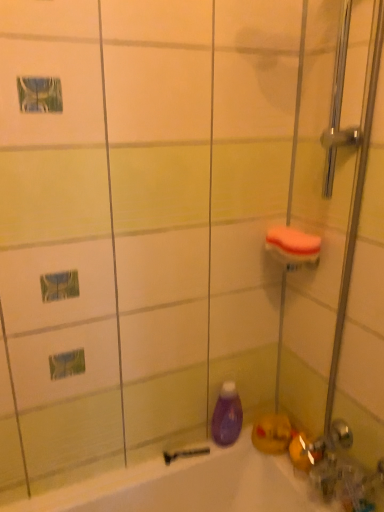
Question: Considering the relative sizes of black rubber razor at lower center and purple glossy bottle at lower center in the image provided, is black rubber razor at lower center thinner than purple glossy bottle at lower center?

Choices:
 (A) no
 (B) yes

Answer: (B)

Question: Considering the relative sizes of black rubber razor at lower center and purple glossy bottle at lower center in the image provided, is black rubber razor at lower center bigger than purple glossy bottle at lower center?

Choices:
 (A) yes
 (B) no

Answer: (B)

Question: Is purple glossy bottle at lower center located within black rubber razor at lower center?

Choices:
 (A) yes
 (B) no

Answer: (B)

Question: From the image's perspective, does black rubber razor at lower center appear lower than purple glossy bottle at lower center?

Choices:
 (A) no
 (B) yes

Answer: (B)

Question: Does black rubber razor at lower center have a greater height compared to purple glossy bottle at lower center?

Choices:
 (A) yes
 (B) no

Answer: (B)

Question: Is black rubber razor at lower center to the left of purple glossy bottle at lower center from the viewer's perspective?

Choices:
 (A) no
 (B) yes

Answer: (B)

Question: Is purple glossy bottle at lower center further to camera compared to black rubber razor at lower center?

Choices:
 (A) yes
 (B) no

Answer: (B)

Question: From the image's perspective, would you say purple glossy bottle at lower center is shown under black rubber razor at lower center?

Choices:
 (A) no
 (B) yes

Answer: (A)

Question: From a real-world perspective, is purple glossy bottle at lower center physically above black rubber razor at lower center?

Choices:
 (A) no
 (B) yes

Answer: (B)

Question: Is purple glossy bottle at lower center positioned with its back to black rubber razor at lower center?

Choices:
 (A) no
 (B) yes

Answer: (A)

Question: From the image's perspective, is purple glossy bottle at lower center above black rubber razor at lower center?

Choices:
 (A) no
 (B) yes

Answer: (B)

Question: Considering the relative sizes of purple glossy bottle at lower center and black rubber razor at lower center in the image provided, is purple glossy bottle at lower center thinner than black rubber razor at lower center?

Choices:
 (A) yes
 (B) no

Answer: (B)

Question: Does orange sponge at upper right contain clear glass shower door at right?

Choices:
 (A) yes
 (B) no

Answer: (B)